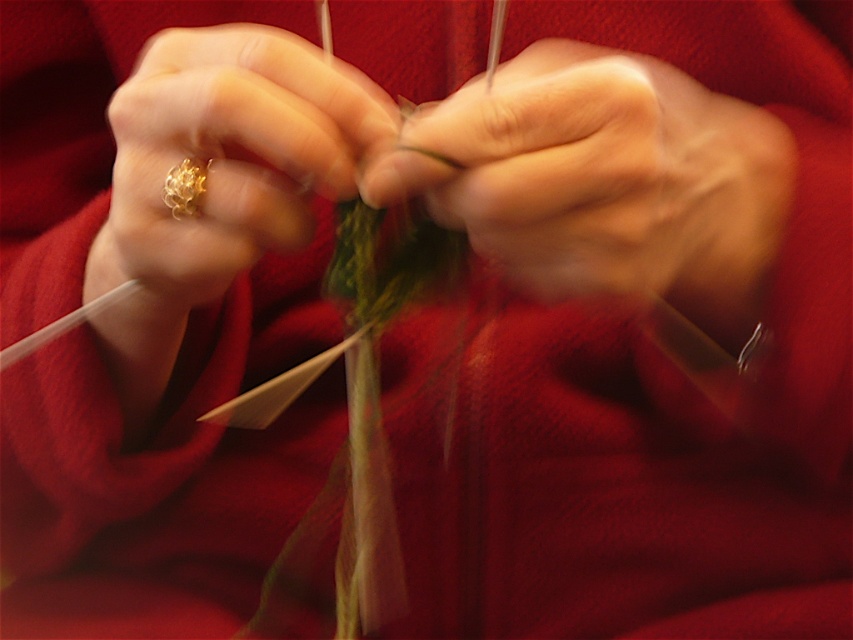
Question: Is green yarn at center wider than gold textured ring at center?

Choices:
 (A) yes
 (B) no

Answer: (A)

Question: Can you confirm if green yarn at center is positioned to the left of gold textured ring at center?

Choices:
 (A) yes
 (B) no

Answer: (B)

Question: Which point appears closest to the camera in this image?

Choices:
 (A) click(x=231, y=241)
 (B) click(x=384, y=202)

Answer: (B)

Question: Which object is farther from the camera taking this photo?

Choices:
 (A) gold textured ring at center
 (B) green yarn at center

Answer: (B)

Question: Can you confirm if green yarn at center is positioned to the left of gold textured ring at center?

Choices:
 (A) yes
 (B) no

Answer: (B)